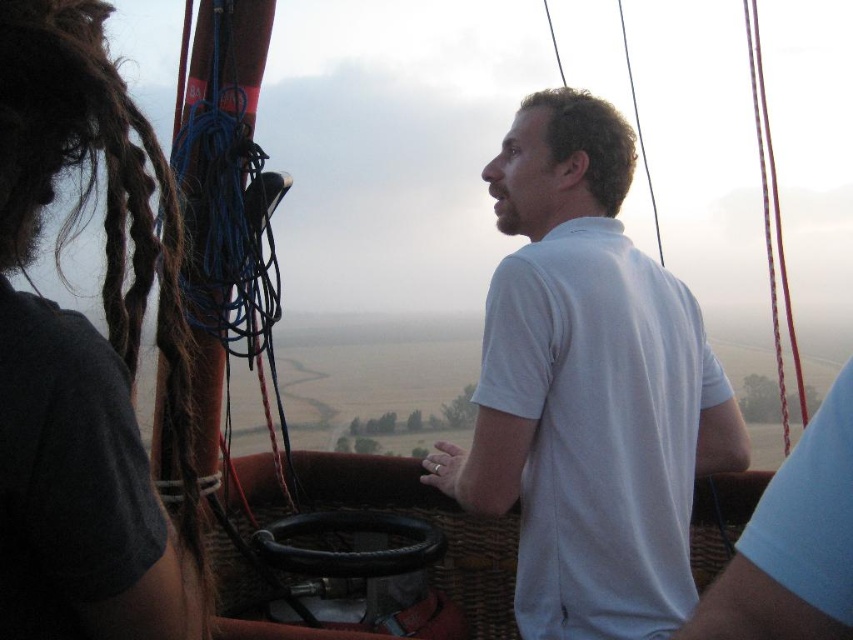
Can you confirm if white matte shirt at center is positioned below dark brown dreadlocks at left?

Yes, white matte shirt at center is below dark brown dreadlocks at left.

Who is positioned more to the left, white matte shirt at center or dark brown dreadlocks at left?

Positioned to the left is dark brown dreadlocks at left.

Is point (640, 564) more distant than point (22, 579)?

Yes, point (640, 564) is behind point (22, 579).

I want to click on white matte shirt at center, so click(x=589, y=388).